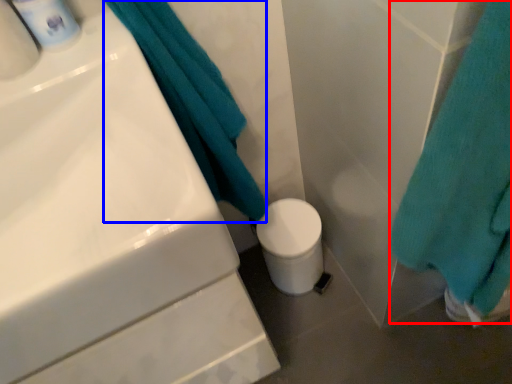
Question: Which point is closer to the camera, bath towel (highlighted by a red box) or bath towel (highlighted by a blue box)?

Choices:
 (A) bath towel
 (B) bath towel

Answer: (A)